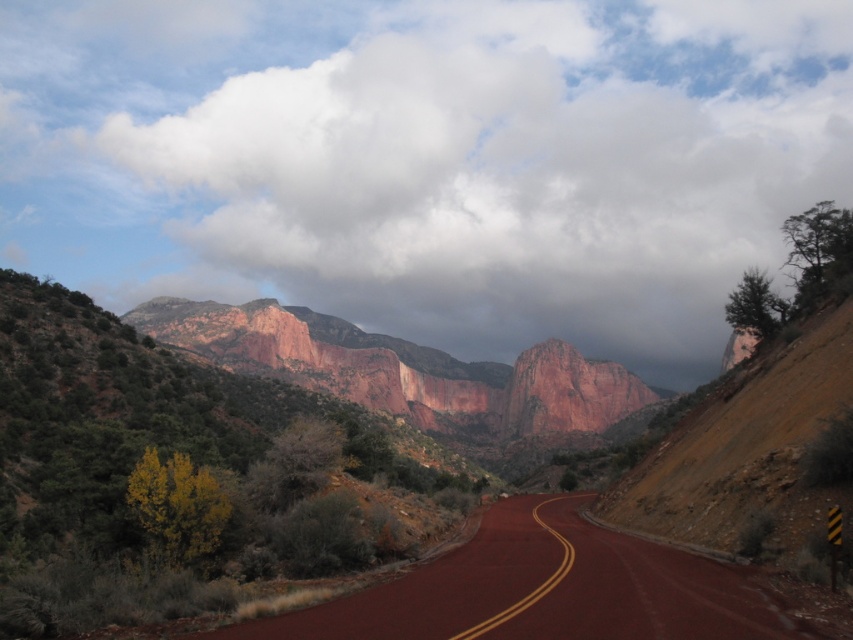
You are a driver approaching the scenic road and looking at the cloudy sky at upper center and the smooth asphalt road at center. Which object is located higher in the image?

The cloudy sky at upper center is located higher in the image than the smooth asphalt road at center.

You are a photographer planning to take a landscape photo of the cloudy sky at upper center and the smooth asphalt road at center. Based on the scene, which object appears higher in the image?

The cloudy sky at upper center appears higher in the image than the smooth asphalt road at center because it is taller according to the description.